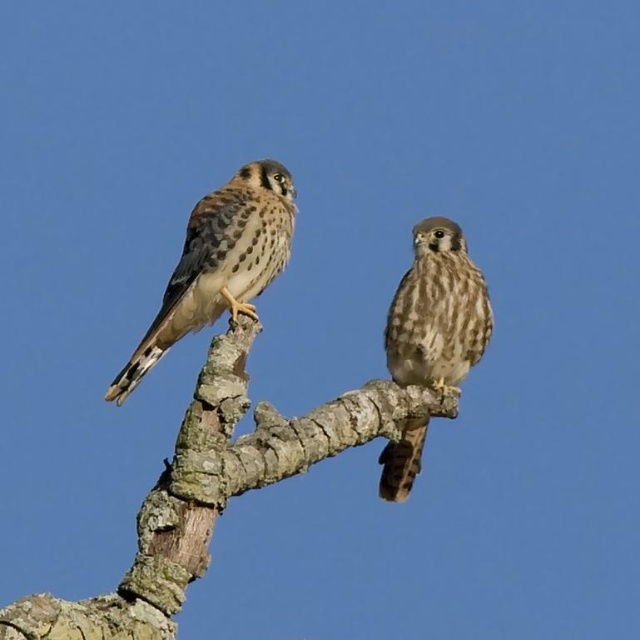
Question: Can you confirm if brown rough tree branch at center is bigger than brown speckled feathers at left?

Choices:
 (A) yes
 (B) no

Answer: (A)

Question: Which of the following is the closest to the observer?

Choices:
 (A) brown rough tree branch at center
 (B) brown speckled feathers at left
 (C) brown speckled feathers at center

Answer: (A)

Question: Which point is farther from the camera taking this photo?

Choices:
 (A) (156, 323)
 (B) (173, 611)
 (C) (440, 253)

Answer: (C)

Question: Is brown speckled feathers at left above brown speckled feathers at center?

Choices:
 (A) no
 (B) yes

Answer: (B)

Question: Which point is farther from the camera taking this photo?

Choices:
 (A) (387, 353)
 (B) (164, 481)

Answer: (A)

Question: Is brown speckled feathers at left below brown speckled feathers at center?

Choices:
 (A) yes
 (B) no

Answer: (B)